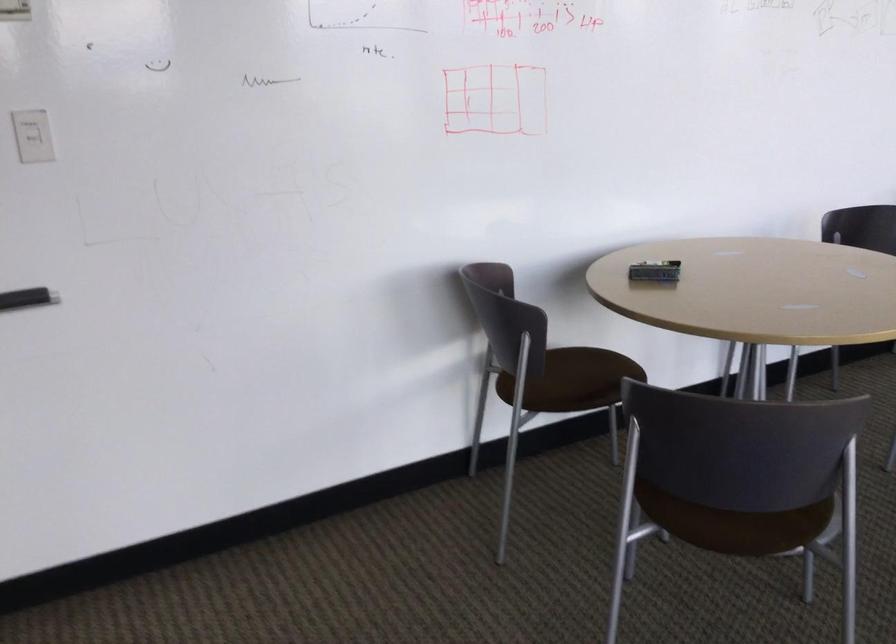
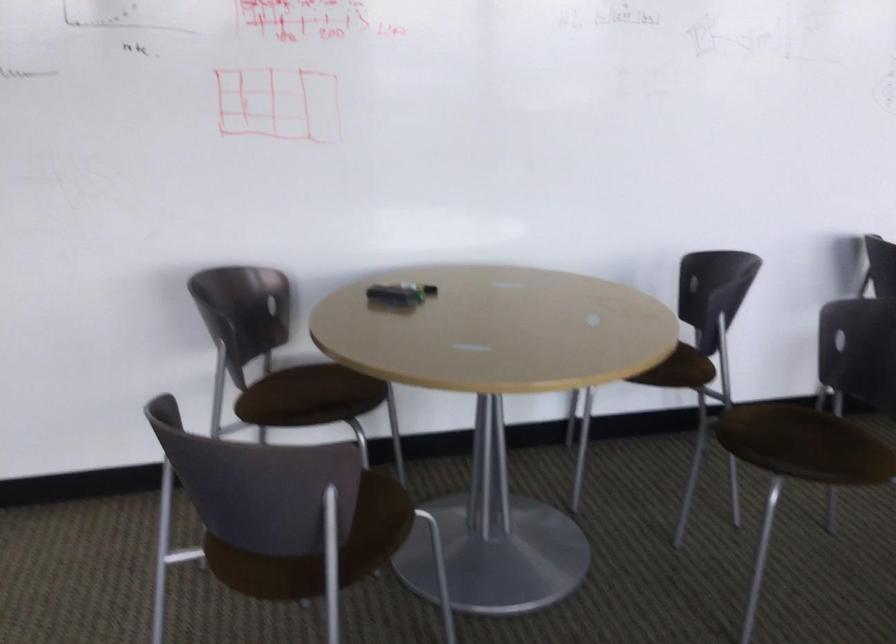
Locate, in the second image, the point that corresponds to point 578,368 in the first image.

(314, 384)